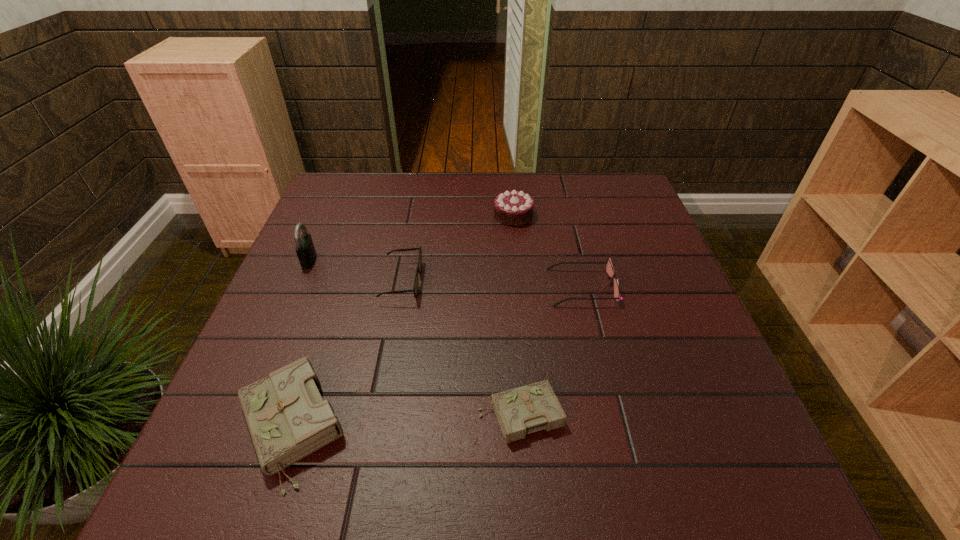
Image resolution: width=960 pixels, height=540 pixels. Identify the location of free space between the left sunglasses and the taller diary. pyautogui.click(x=346, y=354).

Where is `free spot between the farthest object and the left diary`? The image size is (960, 540). free spot between the farthest object and the left diary is located at coordinates (402, 321).

Identify the location of free space between the tallest object and the taller diary. The image size is (960, 540). (300, 343).

Locate an element on the screen. The image size is (960, 540). empty location between the shortest object and the tallest object is located at coordinates (415, 338).

Find the location of a particular element. unoccupied position between the fourth object from right to left and the left diary is located at coordinates (346, 354).

At what (x,y) coordinates should I click in order to perform the action: click on free space between the left diary and the left sunglasses. Please return your answer as a coordinate pair (x, y). The image size is (960, 540). Looking at the image, I should click on (346, 354).

Locate an element on the screen. Image resolution: width=960 pixels, height=540 pixels. free spot between the taller diary and the shortest object is located at coordinates (405, 421).

The image size is (960, 540). Find the location of `empty space between the farthest object and the third object from left to right`. empty space between the farthest object and the third object from left to right is located at coordinates (457, 248).

Find the location of a particular element. Image resolution: width=960 pixels, height=540 pixels. object that can be found as the fifth closest to the tallest object is located at coordinates (609, 268).

Identify which object is located as the second nearest to the taller diary. Please provide its 2D coordinates. Your answer should be formatted as a tuple, i.e. [(x, y)], where the tuple contains the x and y coordinates of a point satisfying the conditions above.

[(520, 411)]